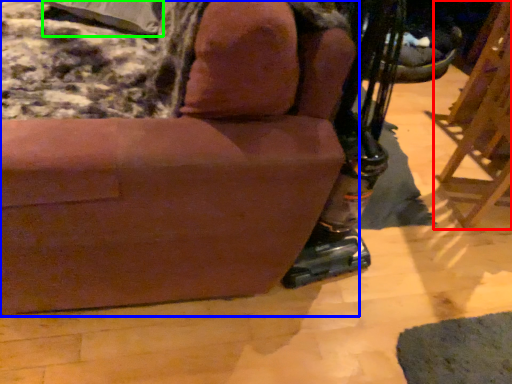
Question: Which object is positioned farthest from furniture (highlighted by a red box)? Select from chair (highlighted by a blue box) and pillow (highlighted by a green box).

Choices:
 (A) chair
 (B) pillow

Answer: (B)